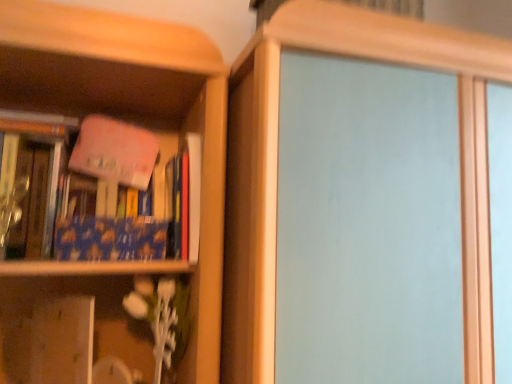
Question: From the image's perspective, is transparent glass screen door at center located above wooden vase at lower left?

Choices:
 (A) no
 (B) yes

Answer: (B)

Question: Is transparent glass screen door at center positioned in front of wooden vase at lower left?

Choices:
 (A) no
 (B) yes

Answer: (B)

Question: Does transparent glass screen door at center have a larger size compared to wooden vase at lower left?

Choices:
 (A) yes
 (B) no

Answer: (A)

Question: Would you say transparent glass screen door at center is a long distance from wooden vase at lower left?

Choices:
 (A) yes
 (B) no

Answer: (B)

Question: Is wooden vase at lower left surrounded by transparent glass screen door at center?

Choices:
 (A) no
 (B) yes

Answer: (A)

Question: Does transparent glass screen door at center turn towards wooden vase at lower left?

Choices:
 (A) no
 (B) yes

Answer: (A)

Question: Is transparent glass screen door at center bigger than blue matte book at left, which is counted as the second book, starting from the right?

Choices:
 (A) yes
 (B) no

Answer: (A)

Question: Is transparent glass screen door at center taller than blue matte book at left, which ranks as the 1th book in left-to-right order?

Choices:
 (A) no
 (B) yes

Answer: (B)

Question: Would you consider transparent glass screen door at center to be distant from blue matte book at left, which ranks as the 1th book in left-to-right order?

Choices:
 (A) yes
 (B) no

Answer: (B)

Question: Is transparent glass screen door at center directly adjacent to blue matte book at left, which is counted as the second book, starting from the right?

Choices:
 (A) no
 (B) yes

Answer: (A)

Question: Can you confirm if transparent glass screen door at center is positioned to the right of blue matte book at left, which ranks as the 1th book in left-to-right order?

Choices:
 (A) no
 (B) yes

Answer: (B)

Question: From the image's perspective, is transparent glass screen door at center below blue matte book at left, which is counted as the second book, starting from the right?

Choices:
 (A) yes
 (B) no

Answer: (A)

Question: Does blue matte book at left, which is counted as the second book, starting from the right, have a lesser height compared to transparent glass screen door at center?

Choices:
 (A) yes
 (B) no

Answer: (A)